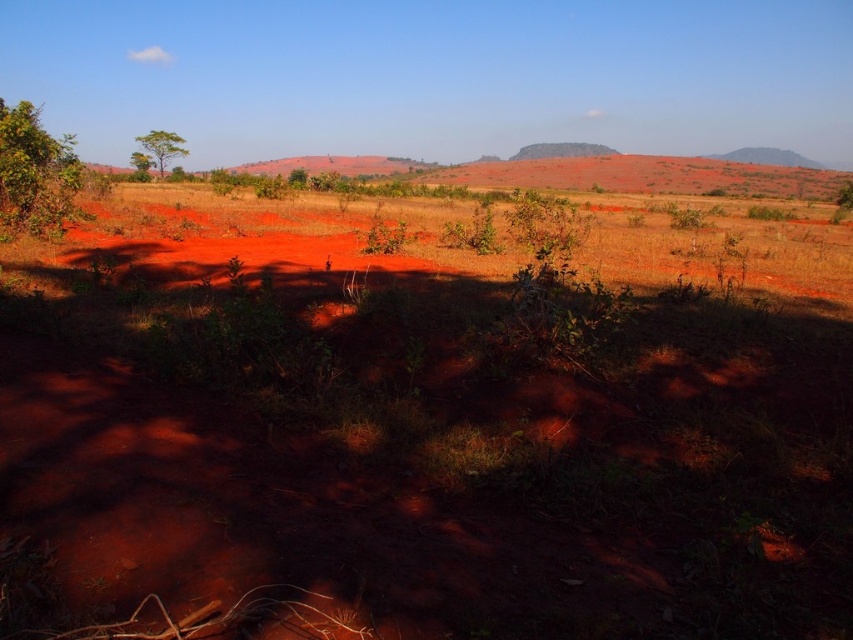
Question: Is green leafy tree at left closer to the viewer compared to green leafy tree at upper left?

Choices:
 (A) no
 (B) yes

Answer: (B)

Question: Which point is farther to the camera?

Choices:
 (A) (68, 196)
 (B) (172, 147)

Answer: (B)

Question: Which object appears closest to the camera in this image?

Choices:
 (A) green leafy tree at upper left
 (B) green leafy tree at left

Answer: (B)

Question: Is green leafy tree at left further to the viewer compared to green leafy tree at upper left?

Choices:
 (A) yes
 (B) no

Answer: (B)

Question: Does green leafy tree at left appear on the right side of green leafy tree at upper left?

Choices:
 (A) no
 (B) yes

Answer: (A)